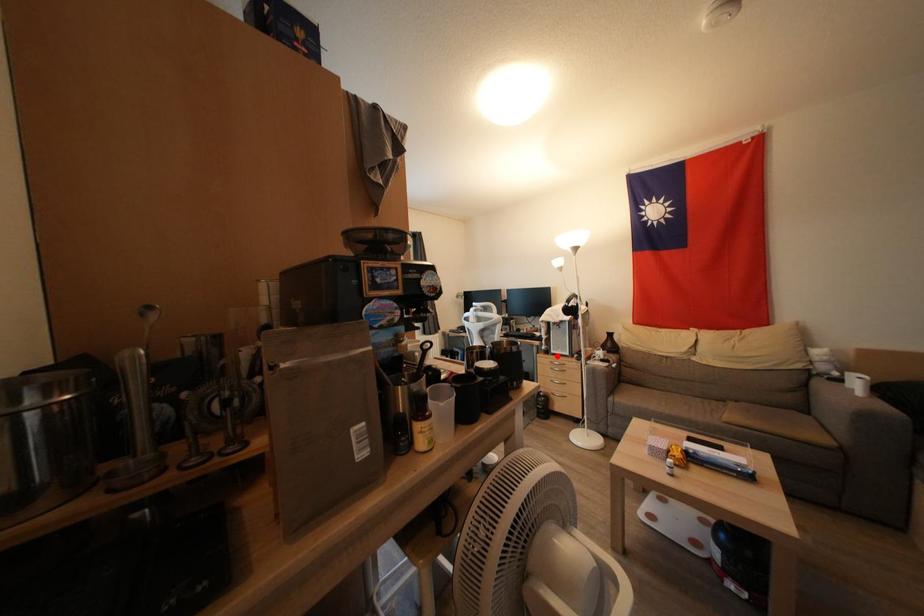
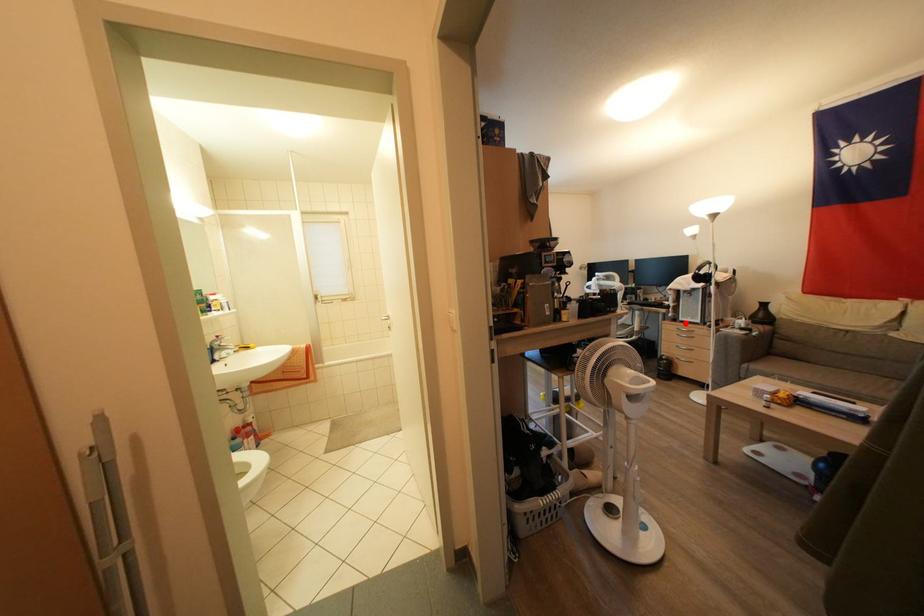
I am providing you with two images of the same scene from different viewpoints. A red point is marked on the first image and another point is marked on the second image. Does the point marked in image1 correspond to the same location as the one in image2?

Yes